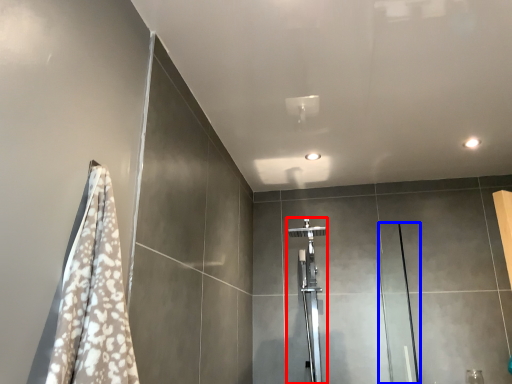
Question: Which object appears farthest to the camera in this image, shower (highlighted by a red box) or screen door (highlighted by a blue box)?

Choices:
 (A) shower
 (B) screen door

Answer: (A)